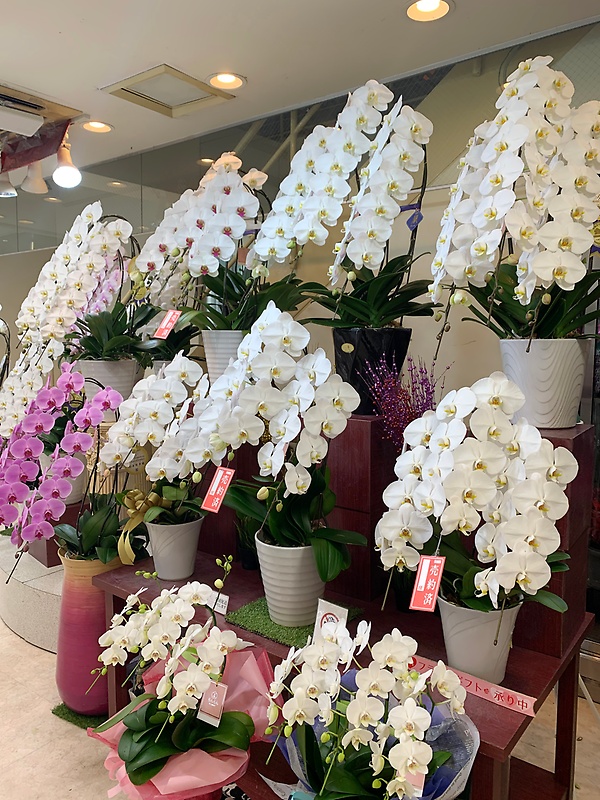
Image resolution: width=600 pixels, height=800 pixels. What are the coordinates of `table` in the screenshot? It's located at (577, 426), (537, 678).